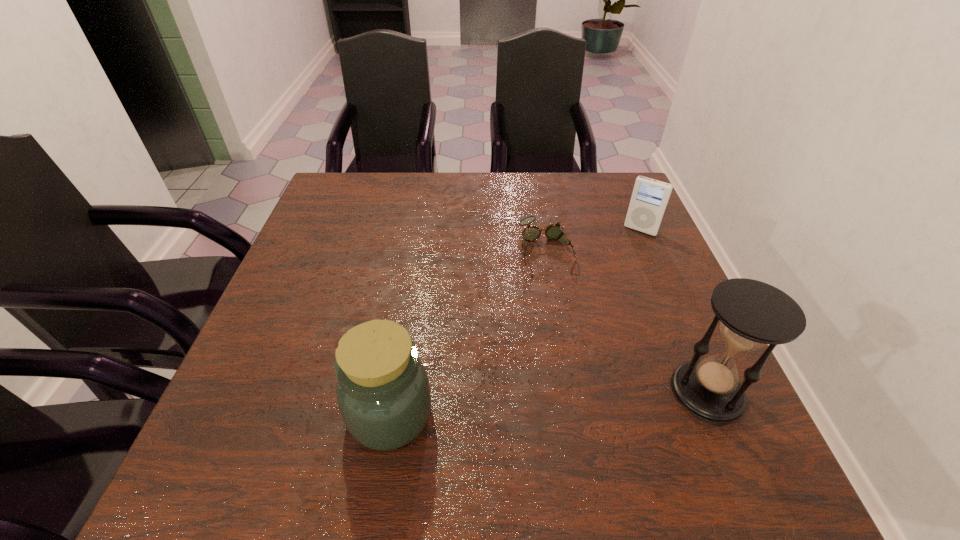
Image resolution: width=960 pixels, height=540 pixels. In order to click on free space on the desktop that is between the jar and the tallest object and is positioned on the front-facing side of the spectacles in this screenshot , I will do [588, 400].

Image resolution: width=960 pixels, height=540 pixels. Find the location of `free spot on the desktop that is between the second tallest object and the hourglass and is positioned on the front-facing side of the second shortest object`. free spot on the desktop that is between the second tallest object and the hourglass and is positioned on the front-facing side of the second shortest object is located at coordinates (536, 404).